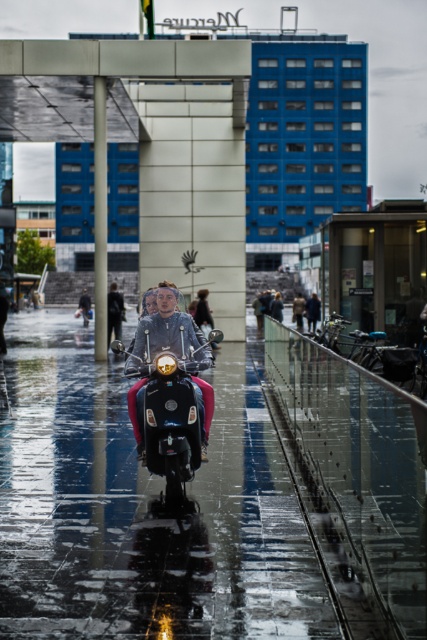
Question: Is shiny black scooter at center positioned before matte gray jacket at center?

Choices:
 (A) yes
 (B) no

Answer: (A)

Question: Which point appears closest to the camera in this image?

Choices:
 (A) (110, 333)
 (B) (198, 404)

Answer: (B)

Question: Which point appears farthest from the camera in this image?

Choices:
 (A) (157, 449)
 (B) (122, 307)

Answer: (B)

Question: Among these points, which one is farthest from the camera?

Choices:
 (A) (160, 452)
 (B) (116, 285)

Answer: (B)

Question: Can you confirm if shiny black scooter at center is positioned below matte gray jacket at center?

Choices:
 (A) no
 (B) yes

Answer: (B)

Question: Does shiny black scooter at center appear on the left side of matte gray jacket at center?

Choices:
 (A) no
 (B) yes

Answer: (A)